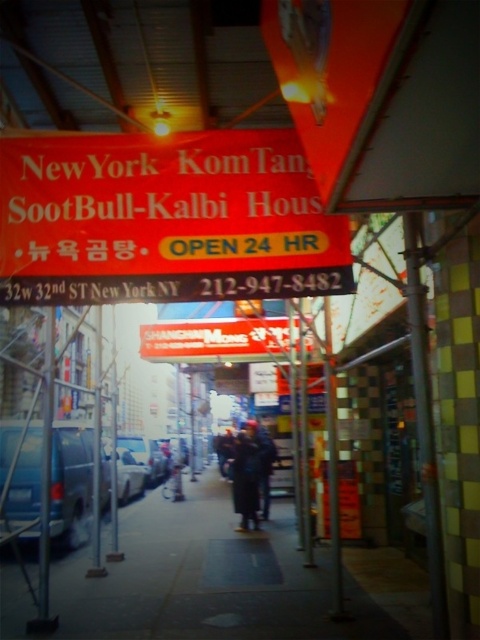
Can you confirm if blue matte van at center is shorter than silver metallic car at center?

In fact, blue matte van at center may be taller than silver metallic car at center.

Is point (14, 483) behind point (120, 458)?

No.

This screenshot has width=480, height=640. In order to click on blue matte van at center in this screenshot , I will do `click(71, 483)`.

Who is lower down, white matte sign at center or metallic silver car at center?

metallic silver car at center

In the scene shown: Can you confirm if white matte sign at center is taller than metallic silver car at center?

Yes.

At what (x,y) coordinates should I click in order to perform the action: click on white matte sign at center. Please return your answer as a coordinate pair (x, y). Image resolution: width=480 pixels, height=640 pixels. Looking at the image, I should click on (215, 339).

You are a GUI agent. You are given a task and a screenshot of the screen. Output one action in this format:
    pyautogui.click(x=<x>, y=<y>)
    Task: Click on the white matte sign at center
    This screenshot has height=640, width=480.
    Given the screenshot: What is the action you would take?
    pyautogui.click(x=215, y=339)

Who is more distant from viewer, (228, 465) or (127, 467)?

The point (228, 465) is behind.

This screenshot has height=640, width=480. What are the coordinates of `dark blue coat at center` in the screenshot? It's located at (251, 472).